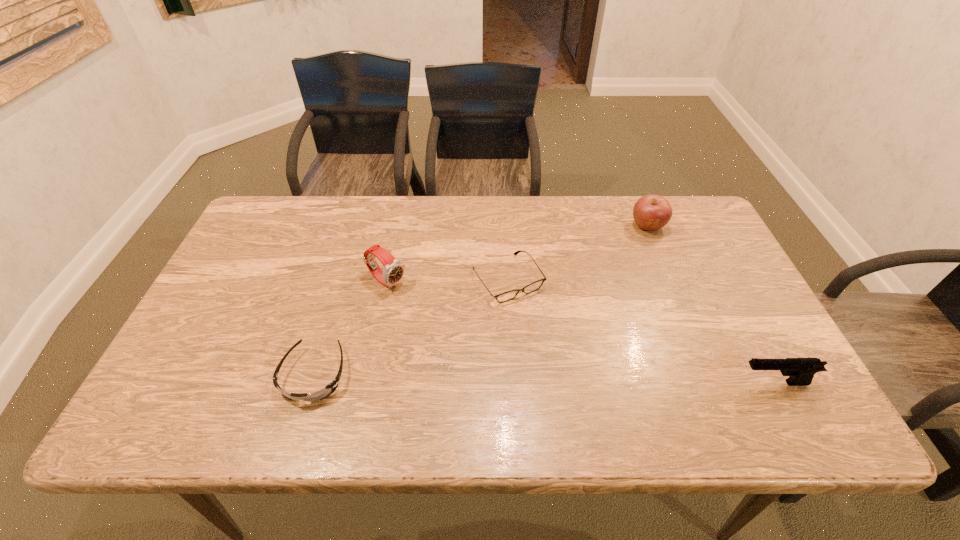
Choose which object is the third nearest neighbor to the apple. Please provide its 2D coordinates. Your answer should be formatted as a tuple, i.e. [(x, y)], where the tuple contains the x and y coordinates of a point satisfying the conditions above.

[(393, 272)]

Locate an element on the screen. vacant area that satisfies the following two spatial constraints: 1. on the front side of the pistol; 2. on the front-facing side of the tallest object is located at coordinates (366, 383).

Locate an element on the screen. This screenshot has height=540, width=960. vacant area in the image that satisfies the following two spatial constraints: 1. on the lenses of the pistol; 2. on the front-facing side of the sunglasses is located at coordinates 312,383.

Find the location of a particular element. vacant point that satisfies the following two spatial constraints: 1. on the lenses of the sunglasses; 2. on the front-facing side of the pistol is located at coordinates (312, 383).

Find the location of `vacant area in the image that satisfies the following two spatial constraints: 1. on the front side of the pistol; 2. on the front-facing side of the apple`. vacant area in the image that satisfies the following two spatial constraints: 1. on the front side of the pistol; 2. on the front-facing side of the apple is located at coordinates (x=712, y=383).

You are a GUI agent. You are given a task and a screenshot of the screen. Output one action in this format:
    pyautogui.click(x=<x>, y=<y>)
    Task: Click on the free spot that satisfies the following two spatial constraints: 1. on the lenses of the pistol; 2. on the front-facing side of the sunglasses
    The width and height of the screenshot is (960, 540).
    Given the screenshot: What is the action you would take?
    pyautogui.click(x=312, y=383)

You are a GUI agent. You are given a task and a screenshot of the screen. Output one action in this format:
    pyautogui.click(x=<x>, y=<y>)
    Task: Click on the free space that satisfies the following two spatial constraints: 1. on the lenses of the pistol; 2. on the front-facing side of the sunglasses
    This screenshot has width=960, height=540.
    Given the screenshot: What is the action you would take?
    pyautogui.click(x=312, y=383)

Identify the location of vacant space that satisfies the following two spatial constraints: 1. on the back side of the tallest object; 2. on the left side of the apple. The height and width of the screenshot is (540, 960). (397, 226).